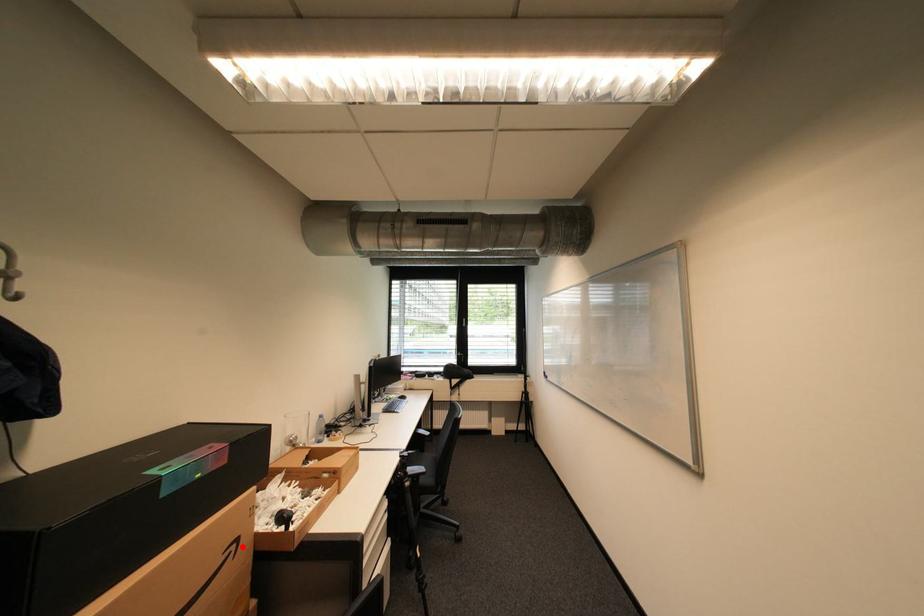
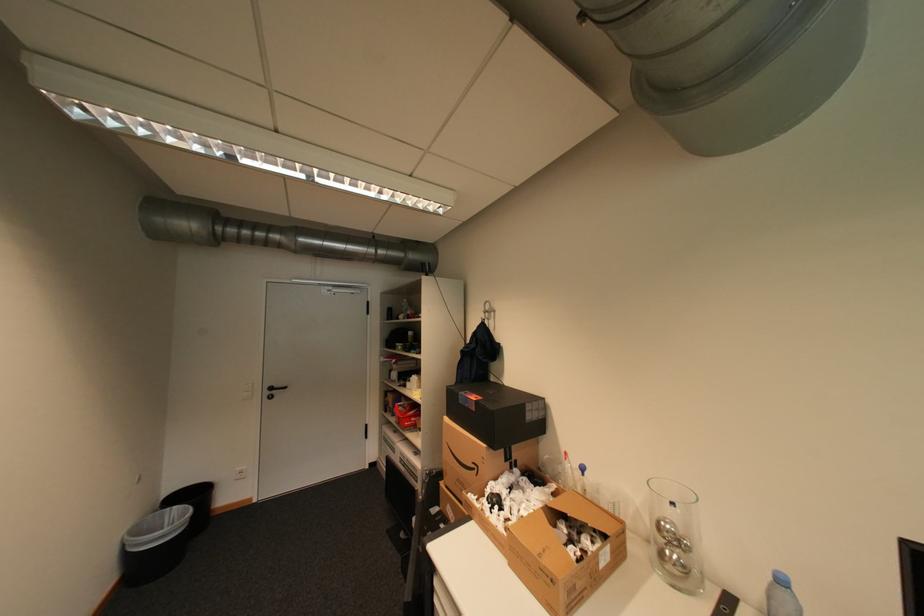
Question: I am providing you with two images of the same scene from different viewpoints. In image1, a red point is highlighted. Considering the same 3D point in image2, which of the following is correct?

Choices:
 (A) It is closer
 (B) It is farther

Answer: (B)